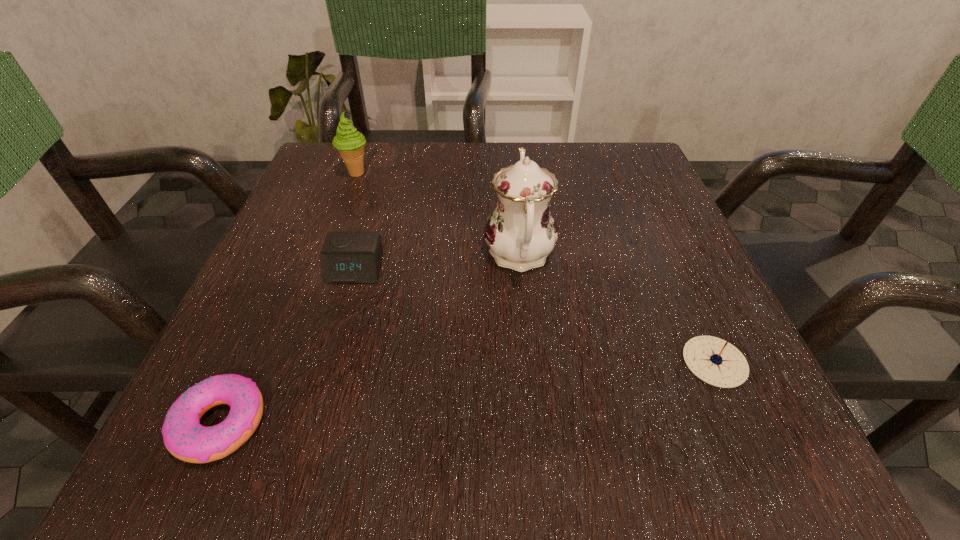
At what (x,y) coordinates should I click in order to perform the action: click on vacant space located 0.310m on the left of the compass. Please return your answer as a coordinate pair (x, y). The height and width of the screenshot is (540, 960). Looking at the image, I should click on pos(462,362).

You are a GUI agent. You are given a task and a screenshot of the screen. Output one action in this format:
    pyautogui.click(x=<x>, y=<y>)
    Task: Click on the free space located on the right of the doughnut
    This screenshot has width=960, height=540.
    Given the screenshot: What is the action you would take?
    pyautogui.click(x=417, y=424)

Identify the location of object present at the far edge. The image size is (960, 540). (350, 143).

You are a GUI agent. You are given a task and a screenshot of the screen. Output one action in this format:
    pyautogui.click(x=<x>, y=<y>)
    Task: Click on the object present at the near edge
    The width and height of the screenshot is (960, 540).
    Given the screenshot: What is the action you would take?
    pyautogui.click(x=185, y=438)

This screenshot has width=960, height=540. I want to click on icecream located in the left edge section of the desktop, so (350, 143).

Find the location of a particular element. Image resolution: width=960 pixels, height=540 pixels. alarm clock that is at the left edge is located at coordinates (347, 257).

What are the coordinates of `doughnut positioned at the left edge` in the screenshot? It's located at (185, 438).

This screenshot has width=960, height=540. In order to click on object present at the right edge in this screenshot , I will do `click(715, 361)`.

I want to click on object located at the far left corner, so click(350, 143).

Where is `object situated at the near left corner`? This screenshot has width=960, height=540. object situated at the near left corner is located at coordinates (185, 438).